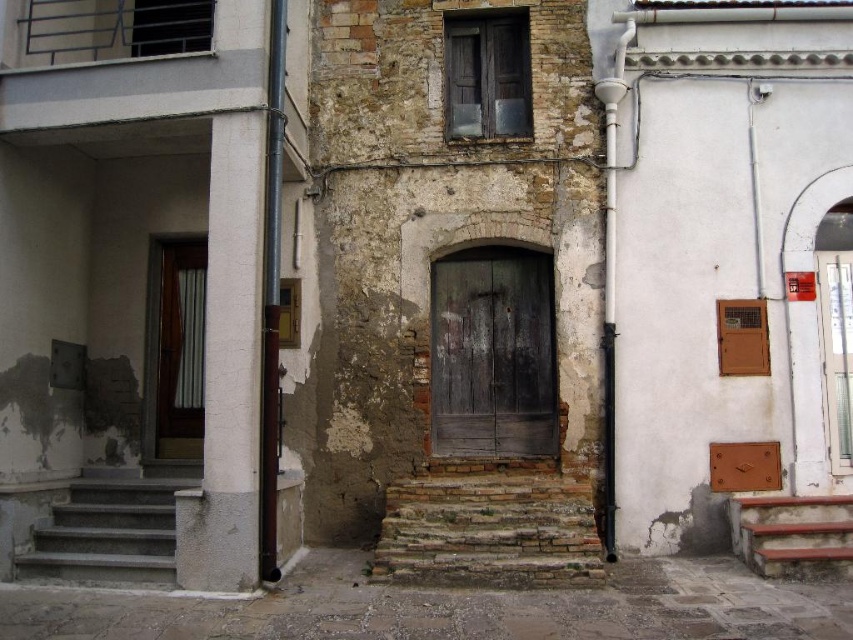
You are a delivery person trying to reach the apartment above the white wood door at center. The stairs leading up to it are the rustic wooden stairs at lower right. Are the stairs located below or above the door?

The white wood door at center is positioned over the rustic wooden stairs at lower right, meaning the stairs are located below the door.

You are a delivery person carrying a package that requires a clear path to the white wood door at center. The rustic wooden stairs at lower right might block your way. Can you reach the door without moving the stairs?

The white wood door at center and rustic wooden stairs at lower right are 5.53 meters apart from each other, so yes, you can reach the door without moving the stairs since the distance between them allows enough space to navigate around the stairs.